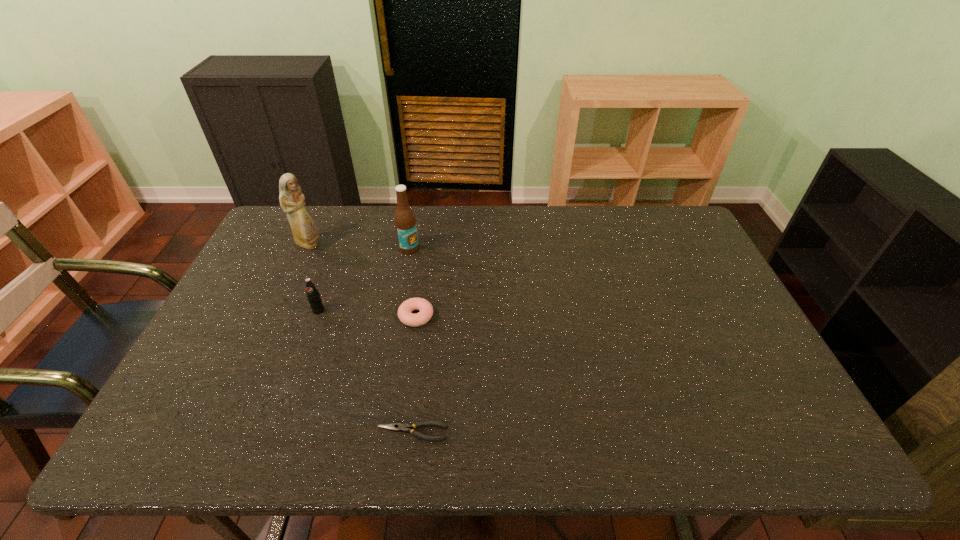
This screenshot has width=960, height=540. Identify the location of vacant space positioned on the front of the doughnut. (404, 398).

I want to click on vacant region located on the left of the pliers, so click(x=291, y=432).

At what (x,y) coordinates should I click in order to perform the action: click on figurine situated at the far edge. Please return your answer as a coordinate pair (x, y). Looking at the image, I should click on (305, 231).

Find the location of `beer bottle present at the far edge`. beer bottle present at the far edge is located at coordinates (405, 223).

Where is `object located in the near edge section of the desktop`? object located in the near edge section of the desktop is located at coordinates (397, 427).

Find the location of a particular element. The width and height of the screenshot is (960, 540). object present at the left edge is located at coordinates (305, 231).

Where is `object located in the far left corner section of the desktop`? object located in the far left corner section of the desktop is located at coordinates 305,231.

In the image, there is a desktop. Where is `vacant space at the far edge`? This screenshot has width=960, height=540. vacant space at the far edge is located at coordinates (432, 235).

I want to click on vacant area at the near edge of the desktop, so click(568, 423).

What are the coordinates of `vacant area at the left edge` in the screenshot? It's located at (226, 317).